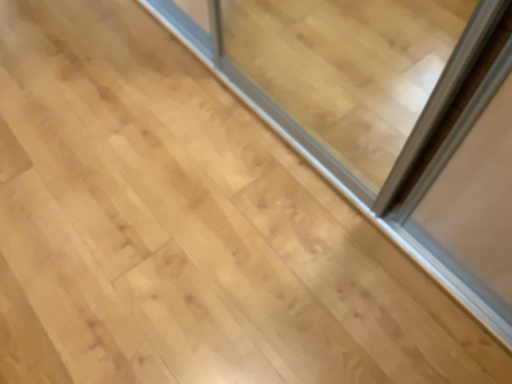
This screenshot has height=384, width=512. Describe the element at coordinates (387, 116) in the screenshot. I see `transparent glass window at upper right` at that location.

In order to face transparent glass window at upper right, should I rotate leftwards or rightwards?

A 9.938 degree turn to the left will do.

Identify the location of transparent glass window at upper right. The image size is (512, 384). (387, 116).

Locate an element on the screen. The width and height of the screenshot is (512, 384). transparent glass window at upper right is located at coordinates (387, 116).